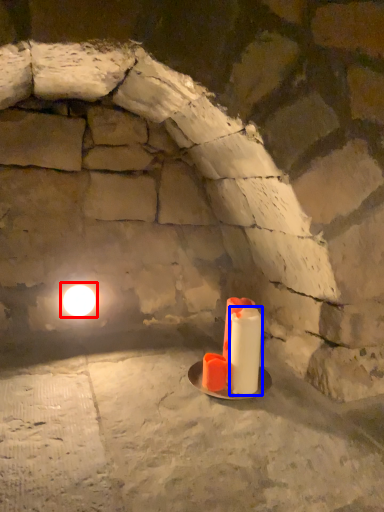
Question: Which object is closer to the camera taking this photo, light (highlighted by a red box) or candle (highlighted by a blue box)?

Choices:
 (A) light
 (B) candle

Answer: (B)